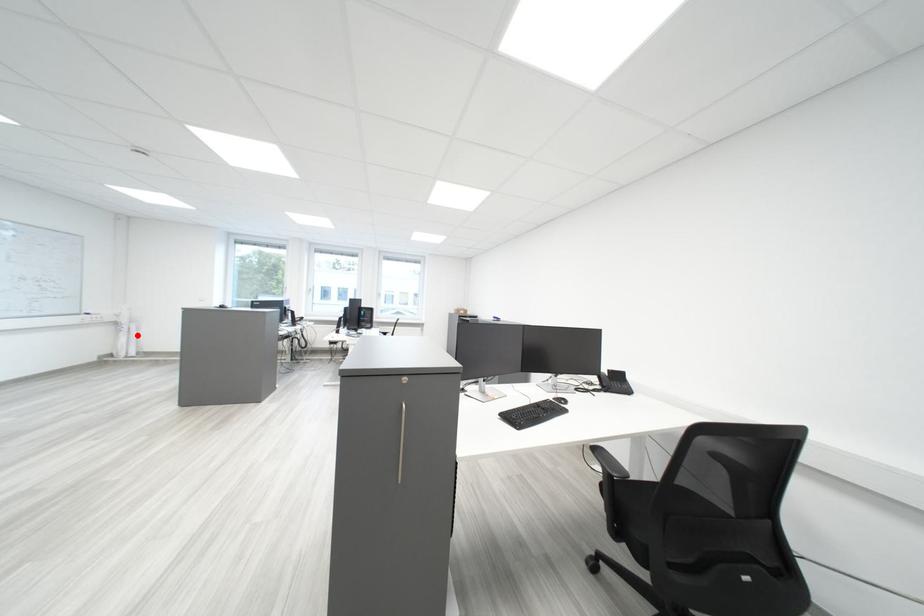
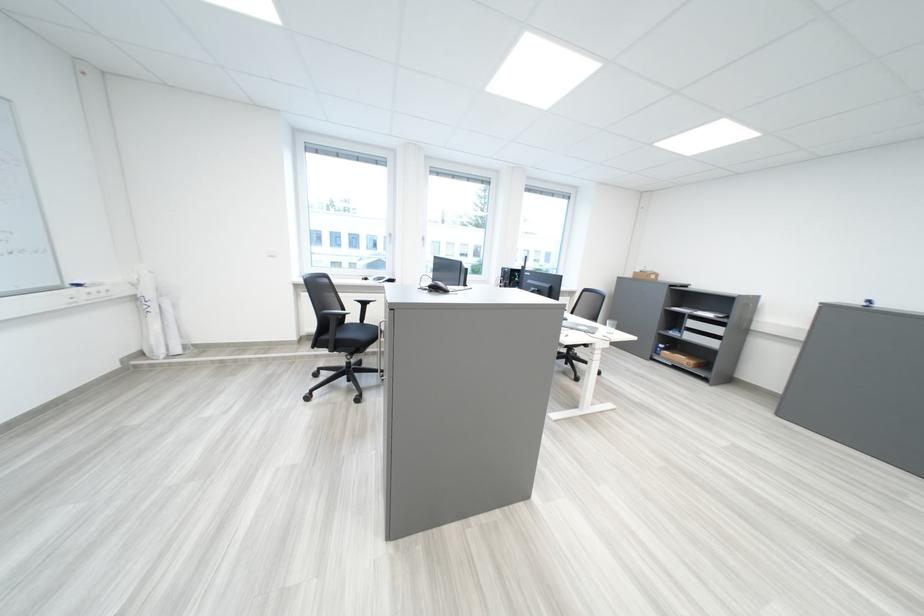
The point at the highlighted location is marked in the first image. Where is the corresponding point in the second image?

(166, 318)